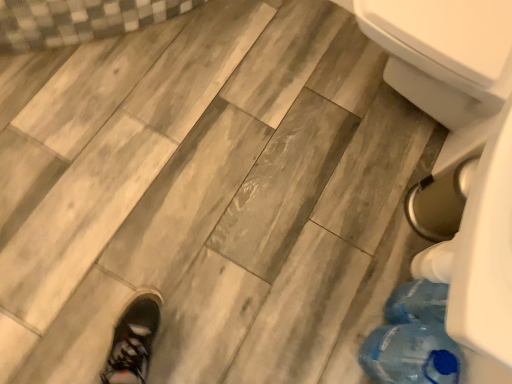
Locate an element on the screen. The image size is (512, 384). vacant area on the back side of transparent plastic bottle at lower right is located at coordinates (364, 282).